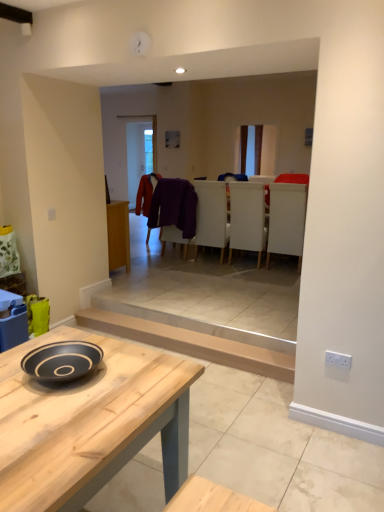
Find the location of a particular element. This screenshot has height=512, width=384. free location above natural wood table at center (from a real-world perspective) is located at coordinates (89, 385).